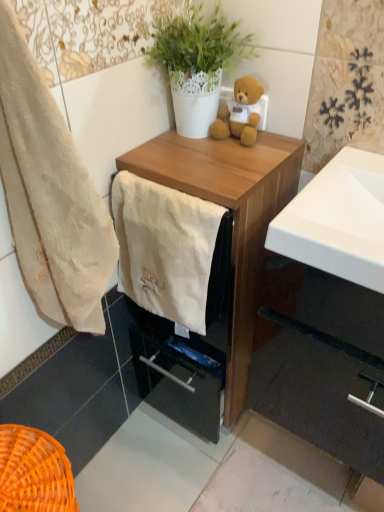
Question: Would you say soft plush teddy bear at upper center is outside white glossy sink at center right?

Choices:
 (A) no
 (B) yes

Answer: (B)

Question: Is soft plush teddy bear at upper center facing towards white glossy sink at center right?

Choices:
 (A) yes
 (B) no

Answer: (B)

Question: Can white glossy sink at center right be found inside soft plush teddy bear at upper center?

Choices:
 (A) no
 (B) yes

Answer: (A)

Question: Is soft plush teddy bear at upper center oriented away from white glossy sink at center right?

Choices:
 (A) no
 (B) yes

Answer: (A)

Question: From a real-world perspective, does soft plush teddy bear at upper center sit lower than white glossy sink at center right?

Choices:
 (A) no
 (B) yes

Answer: (A)

Question: Considering the relative sizes of soft plush teddy bear at upper center and white glossy sink at center right in the image provided, is soft plush teddy bear at upper center shorter than white glossy sink at center right?

Choices:
 (A) yes
 (B) no

Answer: (B)

Question: From a real-world perspective, is matte wood cabinet at lower right beneath wooden chest of drawers at center?

Choices:
 (A) no
 (B) yes

Answer: (B)

Question: Are matte wood cabinet at lower right and wooden chest of drawers at center making contact?

Choices:
 (A) yes
 (B) no

Answer: (B)

Question: Does matte wood cabinet at lower right appear on the right side of wooden chest of drawers at center?

Choices:
 (A) no
 (B) yes

Answer: (B)

Question: Considering the relative sizes of matte wood cabinet at lower right and wooden chest of drawers at center in the image provided, is matte wood cabinet at lower right smaller than wooden chest of drawers at center?

Choices:
 (A) yes
 (B) no

Answer: (A)

Question: Is matte wood cabinet at lower right looking in the opposite direction of wooden chest of drawers at center?

Choices:
 (A) yes
 (B) no

Answer: (B)

Question: Is matte wood cabinet at lower right not within wooden chest of drawers at center?

Choices:
 (A) yes
 (B) no

Answer: (A)

Question: From a real-world perspective, is wooden chest of drawers at center below beige cotton towel at left, which appears as the 1th towel/napkin when viewed from the left?

Choices:
 (A) yes
 (B) no

Answer: (A)